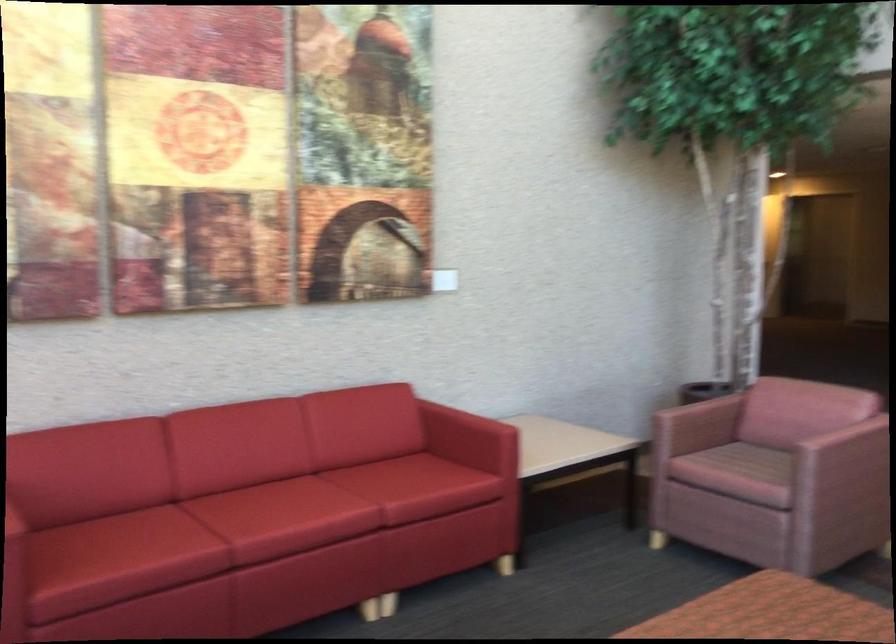
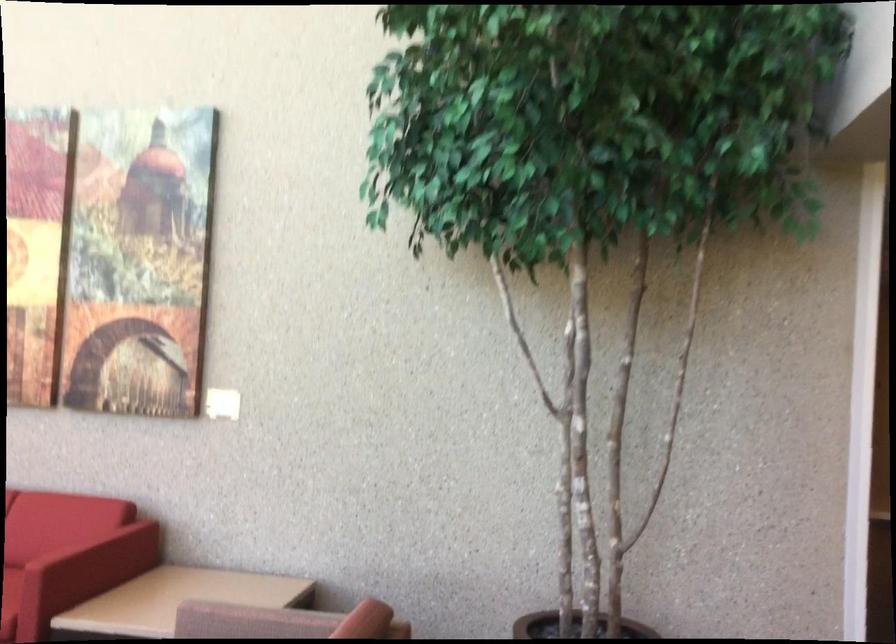
Question: I am providing you with two images of the same scene from different viewpoints. Which of the following objects are not visible in image2?

Choices:
 (A) red sofa sitting surface
 (B) brown chair armrest
 (C) red sofa armrest
 (D) none of these

Answer: (D)